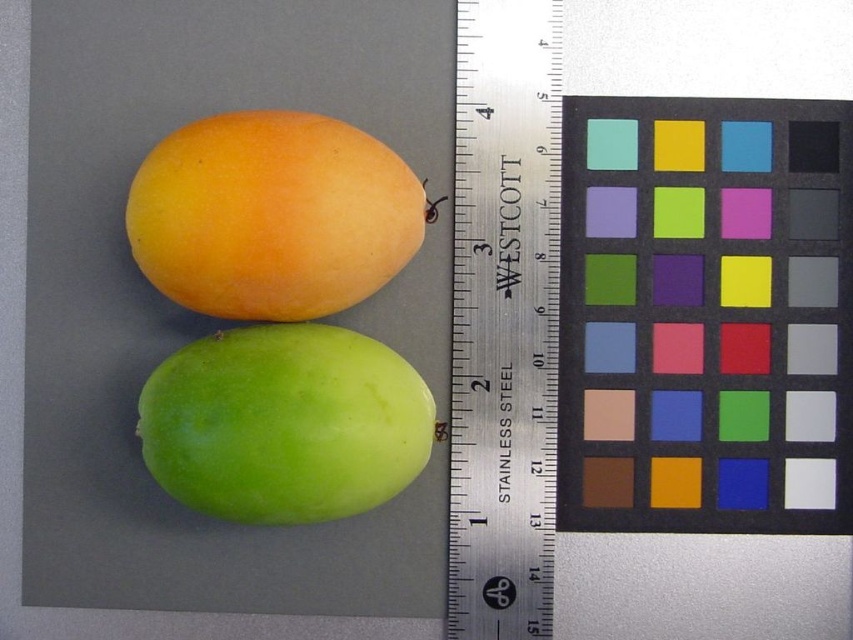
Question: Which of these objects is positioned farthest from the matte orange mango at upper left?

Choices:
 (A) stainless steel ruler at center
 (B) matte black square at upper right

Answer: (B)

Question: Can you confirm if matte black square at upper right is positioned to the left of stainless steel ruler at center?

Choices:
 (A) yes
 (B) no

Answer: (B)

Question: Can you confirm if matte black square at upper right is positioned above stainless steel ruler at center?

Choices:
 (A) yes
 (B) no

Answer: (A)

Question: Which point is farther to the camera?

Choices:
 (A) matte black square at upper right
 (B) matte orange mango at upper left

Answer: (A)

Question: Does matte orange mango at upper left appear on the left side of green matte apple at lower left?

Choices:
 (A) yes
 (B) no

Answer: (A)

Question: Which point is farther to the camera?

Choices:
 (A) stainless steel ruler at center
 (B) matte black square at upper right

Answer: (A)